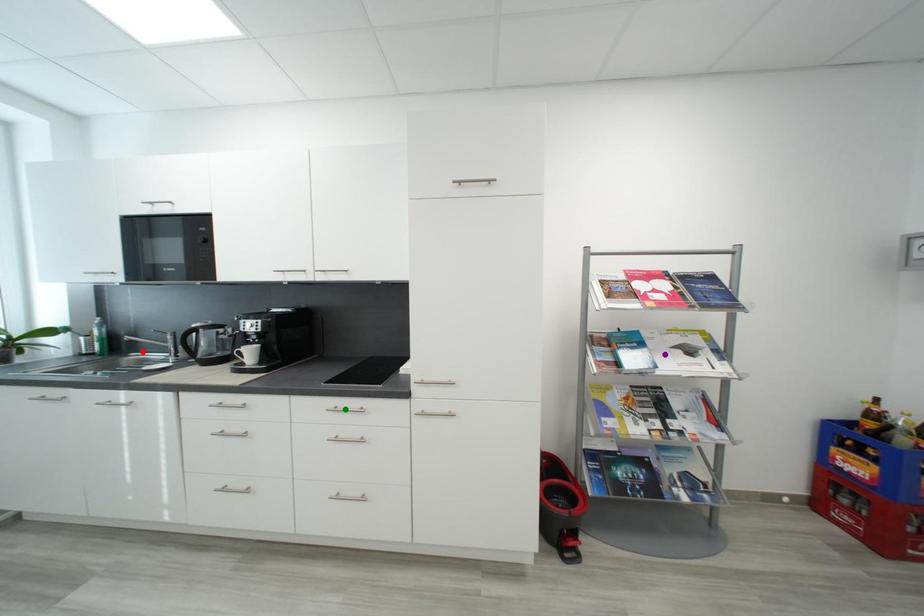
Order these from nearest to farthest:
1. purple point
2. green point
3. red point

green point < purple point < red point